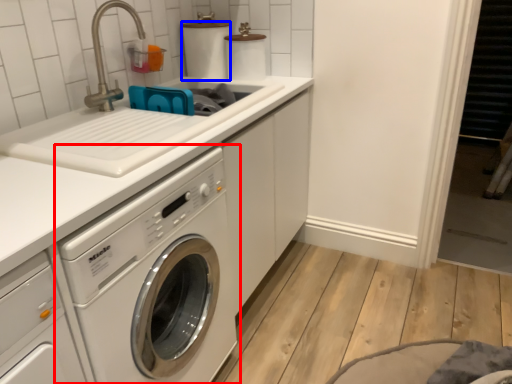
Question: Which of the following is the farthest to the observer, washing machine (highlighted by a red box) or toilet paper (highlighted by a blue box)?

Choices:
 (A) washing machine
 (B) toilet paper

Answer: (B)